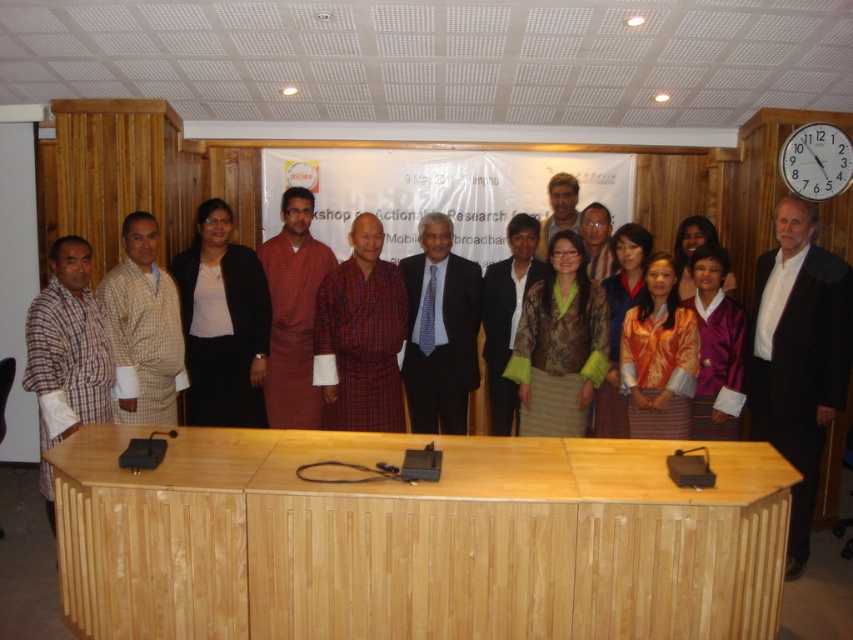
You are a photographer adjusting the camera focus. The blue dotted tie at center and the checkered fabric shirt at left are both in the frame. Which object should you focus on first if you want to ensure the larger one is sharp?

The blue dotted tie at center is larger than the checkered fabric shirt at left, so you should focus on the blue dotted tie at center first to ensure it is sharp.

You are a photographer who wants to ensure that the blue dotted tie at center and the orange silk blouse at center are both visible in the photo. Which one should you focus on to capture both items in the frame?

The blue dotted tie at center is positioned on the left side of the orange silk blouse at center, so focusing on the center area where both are located will ensure both are visible.